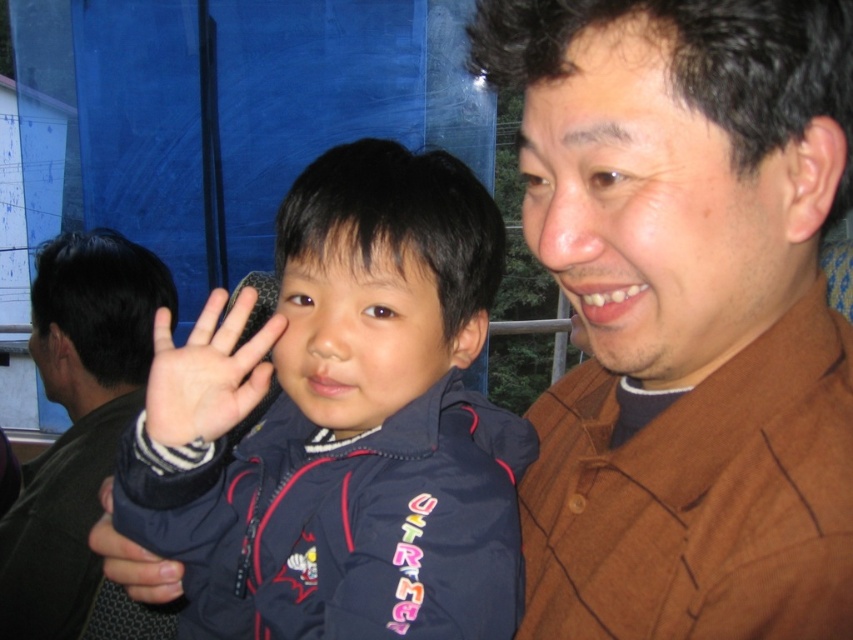
You are a photographer trying to capture the perfect shot of the scene. You notice a specific point in the image at coordinates (685, 312). What object in the scene is located at this point?

The point at coordinates (685, 312) corresponds to the brown textured shirt at upper right.

You are a photographer trying to capture the father and son in the image. The adult is wearing a brown textured shirt at right. If you want to focus your camera on the adult, where should you aim your camera? Provide the coordinates as a point in the format of point with two decimal places. The coordinate system is such that the bottom left corner is the origin point.

The brown textured shirt at right is located at point [77,420]. So you should aim your camera at point [76,422] to focus on the adult wearing the brown textured shirt at right.

You are designing a new clothing line and want to create a matching set using the dark blue fleece jacket at center and the brown textured shirt at right. Which item should be the base layer if you want the top layer to be wider than the base layer?

The dark blue fleece jacket at center has a lesser width compared to the brown textured shirt at right, so the dark blue fleece jacket at center should be the base layer to allow the wider brown textured shirt at right to be the top layer.